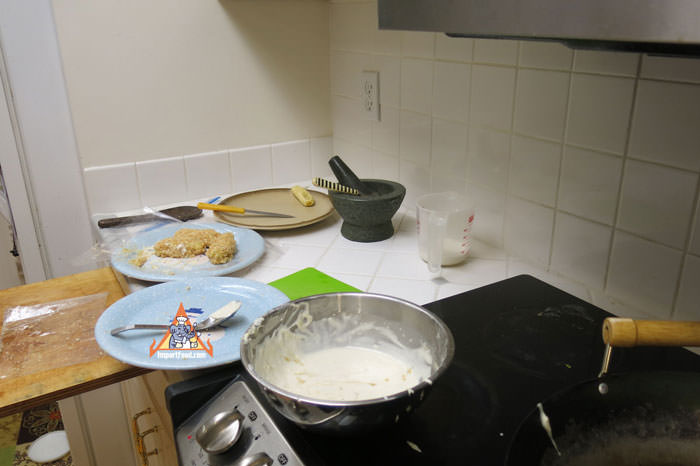
Where is `wall`? wall is located at coordinates (626, 179).